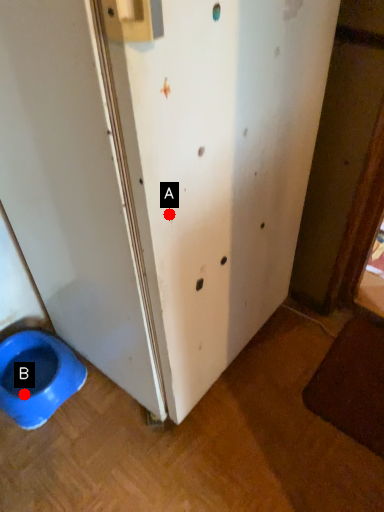
Question: Two points are circled on the image, labeled by A and B beside each circle. Which of the following is the farthest from the observer?

Choices:
 (A) A is further
 (B) B is further

Answer: (B)